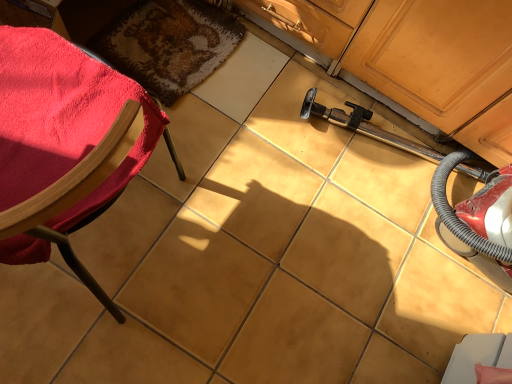
At what (x,y) coordinates should I click in order to perform the action: click on vacant location below velvet red chair at left (from a real-world perspective). Please return your answer as a coordinate pair (x, y). This screenshot has width=512, height=384. Looking at the image, I should click on (100, 243).